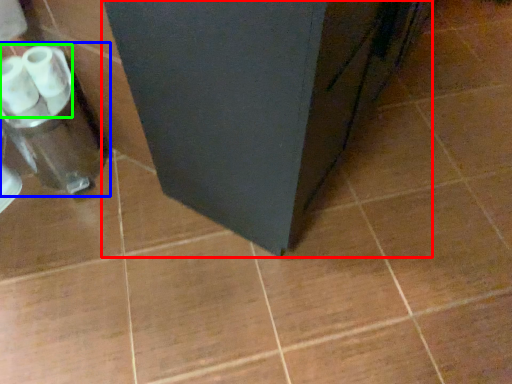
Question: Considering the real-world distances, which object is farthest from furniture (highlighted by a red box)? blender (highlighted by a blue box) or toilet paper (highlighted by a green box)?

Choices:
 (A) blender
 (B) toilet paper

Answer: (B)